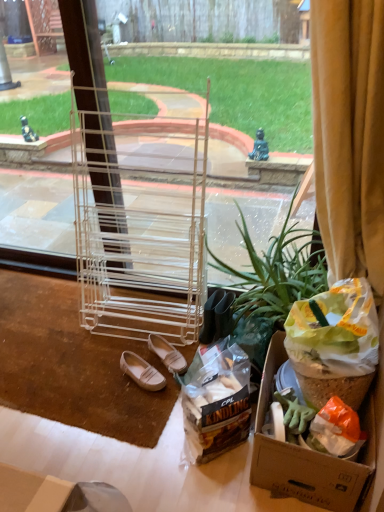
Question: Considering the relative sizes of green leafy plant at center and white leather shoes at lower center, which is the 1th footwear from left to right, in the image provided, is green leafy plant at center taller than white leather shoes at lower center, which is the 1th footwear from left to right,?

Choices:
 (A) no
 (B) yes

Answer: (B)

Question: From the image's perspective, does green leafy plant at center appear lower than white leather shoes at lower center, which is the 1th footwear from left to right?

Choices:
 (A) no
 (B) yes

Answer: (A)

Question: Can you confirm if green leafy plant at center is positioned to the right of white leather shoes at lower center, which is the 1th footwear from left to right?

Choices:
 (A) no
 (B) yes

Answer: (B)

Question: Are green leafy plant at center and white leather shoes at lower center, which is counted as the 2th footwear, starting from the right, beside each other?

Choices:
 (A) no
 (B) yes

Answer: (A)

Question: Is green leafy plant at center bigger than white leather shoes at lower center, which is counted as the 2th footwear, starting from the right?

Choices:
 (A) yes
 (B) no

Answer: (A)

Question: Based on their positions, is green leafy plant at center located to the left or right of clear plastic rack at center?

Choices:
 (A) left
 (B) right

Answer: (B)

Question: Choose the correct answer: Is green leafy plant at center inside clear plastic rack at center or outside it?

Choices:
 (A) outside
 (B) inside

Answer: (A)

Question: From a real-world perspective, is green leafy plant at center physically located above or below clear plastic rack at center?

Choices:
 (A) below
 (B) above

Answer: (A)

Question: Is green leafy plant at center wider or thinner than clear plastic rack at center?

Choices:
 (A) thin
 (B) wide

Answer: (B)

Question: Is green leafy plant at center to the left or to the right of translucent plastic bag of kindling at lower center in the image?

Choices:
 (A) left
 (B) right

Answer: (B)

Question: From the image's perspective, is green leafy plant at center above or below translucent plastic bag of kindling at lower center?

Choices:
 (A) above
 (B) below

Answer: (A)

Question: Looking at the image, does green leafy plant at center seem bigger or smaller compared to translucent plastic bag of kindling at lower center?

Choices:
 (A) small
 (B) big

Answer: (B)

Question: Is green leafy plant at center inside the boundaries of translucent plastic bag of kindling at lower center, or outside?

Choices:
 (A) inside
 (B) outside

Answer: (B)

Question: From their relative heights in the image, would you say clear plastic rack at center is taller or shorter than translucent plastic bag of kindling at lower center?

Choices:
 (A) tall
 (B) short

Answer: (A)

Question: Is clear plastic rack at center bigger or smaller than translucent plastic bag of kindling at lower center?

Choices:
 (A) big
 (B) small

Answer: (A)